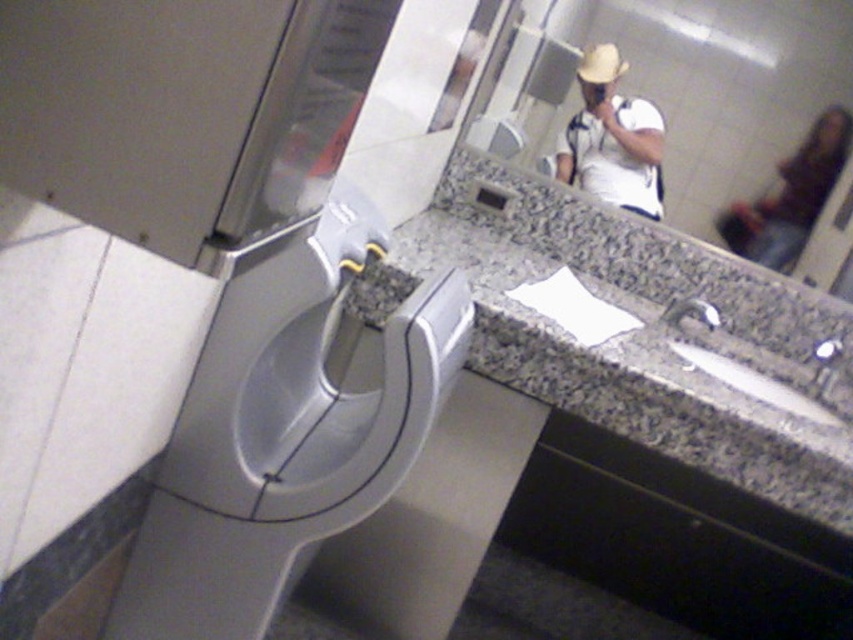
Question: Which object appears closest to the camera in this image?

Choices:
 (A) granite countertop at center
 (B) dark brown leather jacket at upper right
 (C) satin silver urinal at lower left

Answer: (C)

Question: Is granite countertop at center to the right of reflective glass mirror at upper center from the viewer's perspective?

Choices:
 (A) no
 (B) yes

Answer: (A)

Question: Estimate the real-world distances between objects in this image. Which object is farther from the granite countertop at center?

Choices:
 (A) dark brown leather jacket at upper right
 (B) satin silver urinal at lower left
 (C) reflective glass mirror at upper center

Answer: (B)

Question: Does satin silver urinal at lower left have a larger size compared to white matte shirt at upper center?

Choices:
 (A) no
 (B) yes

Answer: (B)

Question: Among these objects, which one is nearest to the camera?

Choices:
 (A) reflective glass mirror at upper center
 (B) granite countertop at center
 (C) satin silver urinal at lower left

Answer: (C)

Question: Observing the image, what is the correct spatial positioning of satin silver urinal at lower left in reference to dark brown leather jacket at upper right?

Choices:
 (A) below
 (B) above

Answer: (A)